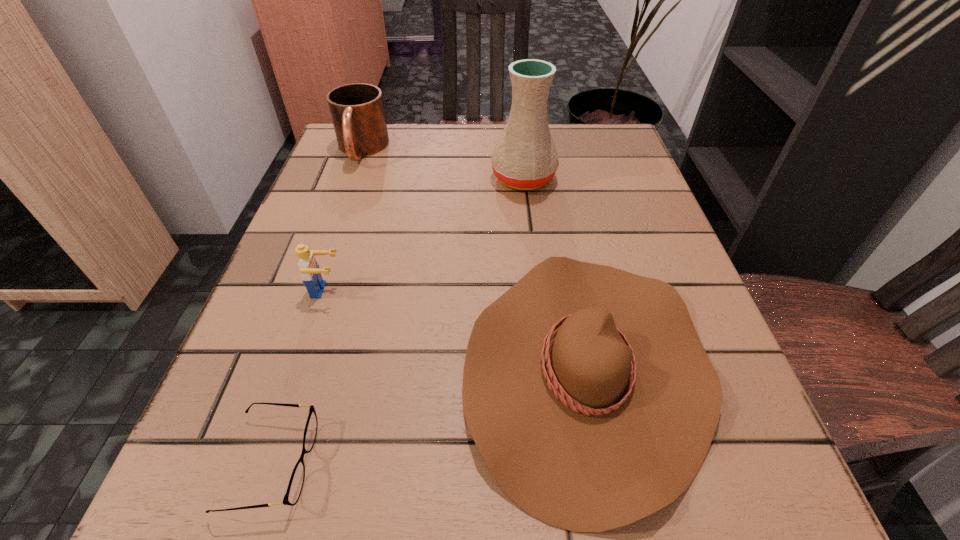
Find the location of `object that is at the near right corner`. object that is at the near right corner is located at coordinates point(586,389).

The width and height of the screenshot is (960, 540). In order to click on vacant space at the far edge in this screenshot , I will do `click(470, 127)`.

What are the coordinates of `vacant space at the near edge of the desktop` in the screenshot? It's located at (395, 510).

In the image, there is a desktop. Identify the location of free space at the left edge. Image resolution: width=960 pixels, height=540 pixels. (322, 361).

The width and height of the screenshot is (960, 540). In order to click on free space at the right edge of the desktop in this screenshot , I will do coord(620,199).

The width and height of the screenshot is (960, 540). In order to click on vacant space at the far left corner in this screenshot , I will do `click(400, 123)`.

At what (x,y) coordinates should I click in order to perform the action: click on vacant region at the far right corner of the desktop. Please return your answer as a coordinate pair (x, y). Image resolution: width=960 pixels, height=540 pixels. Looking at the image, I should click on (588, 174).

You are a GUI agent. You are given a task and a screenshot of the screen. Output one action in this format:
    pyautogui.click(x=<x>, y=<y>)
    Task: Click on the vacant area that lies between the third shortest object and the cowboy hat
    Image resolution: width=960 pixels, height=540 pixels.
    Given the screenshot: What is the action you would take?
    pyautogui.click(x=457, y=329)

You are a GUI agent. You are given a task and a screenshot of the screen. Output one action in this format:
    pyautogui.click(x=<x>, y=<y>)
    Task: Click on the free spot between the mug and the cowboy hat
    
    Given the screenshot: What is the action you would take?
    pyautogui.click(x=474, y=259)

In order to click on free space between the shortest object and the pottery in this screenshot , I will do `click(396, 321)`.